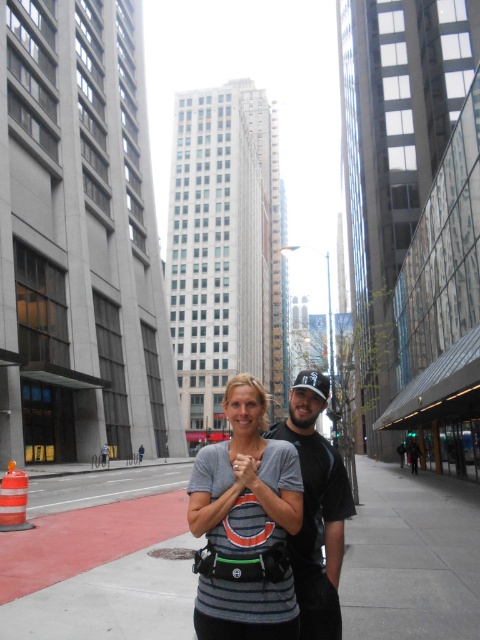
Is gray concrete sidewalk at center above dark gray fabric shirt at center?

No.

Identify the location of gray concrete sidewalk at center. The height and width of the screenshot is (640, 480). (411, 557).

Image resolution: width=480 pixels, height=640 pixels. I want to click on gray concrete sidewalk at center, so (411, 557).

Consider the image. Between dark gray fabric shirt at center and smooth skin hand at center, which one appears on the left side from the viewer's perspective?

smooth skin hand at center

Between dark gray fabric shirt at center and smooth skin hand at center, which one appears on the right side from the viewer's perspective?

Positioned to the right is dark gray fabric shirt at center.

Describe the element at coordinates (315, 508) in the screenshot. This screenshot has width=480, height=640. I see `dark gray fabric shirt at center` at that location.

The width and height of the screenshot is (480, 640). I want to click on dark gray fabric shirt at center, so click(x=315, y=508).

Does gray concrete sidewalk at center appear under gray striped shirt at center?

Indeed, gray concrete sidewalk at center is positioned under gray striped shirt at center.

Looking at this image, can you confirm if gray concrete sidewalk at center is positioned above gray striped shirt at center?

Actually, gray concrete sidewalk at center is below gray striped shirt at center.

You are a GUI agent. You are given a task and a screenshot of the screen. Output one action in this format:
    pyautogui.click(x=<x>, y=<y>)
    Task: Click on the gray concrete sidewalk at center
    Image resolution: width=480 pixels, height=640 pixels.
    Given the screenshot: What is the action you would take?
    pyautogui.click(x=411, y=557)